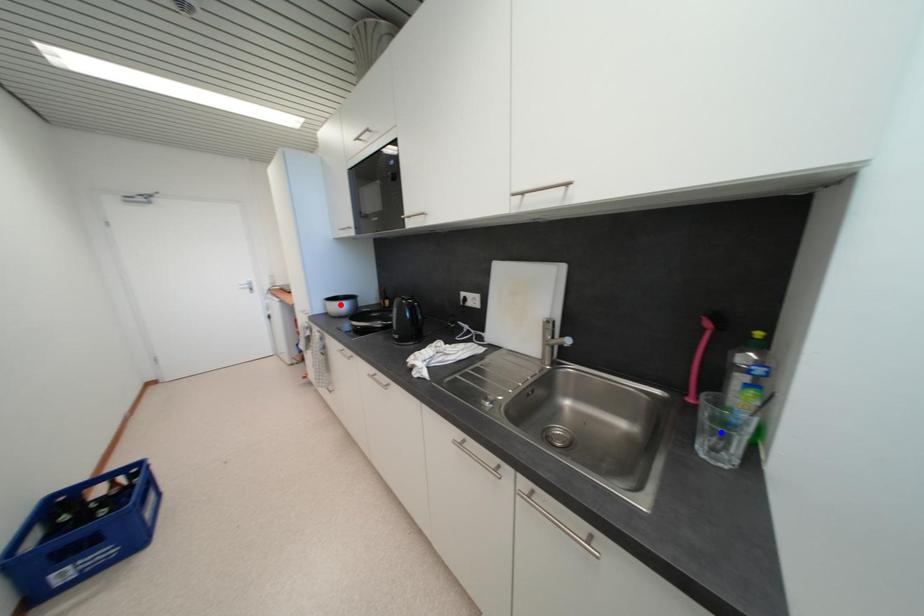
Question: In the image, two points are highlighted. Which point is nearer to the camera? Reply with the corresponding letter.

Choices:
 (A) blue point
 (B) red point

Answer: (A)